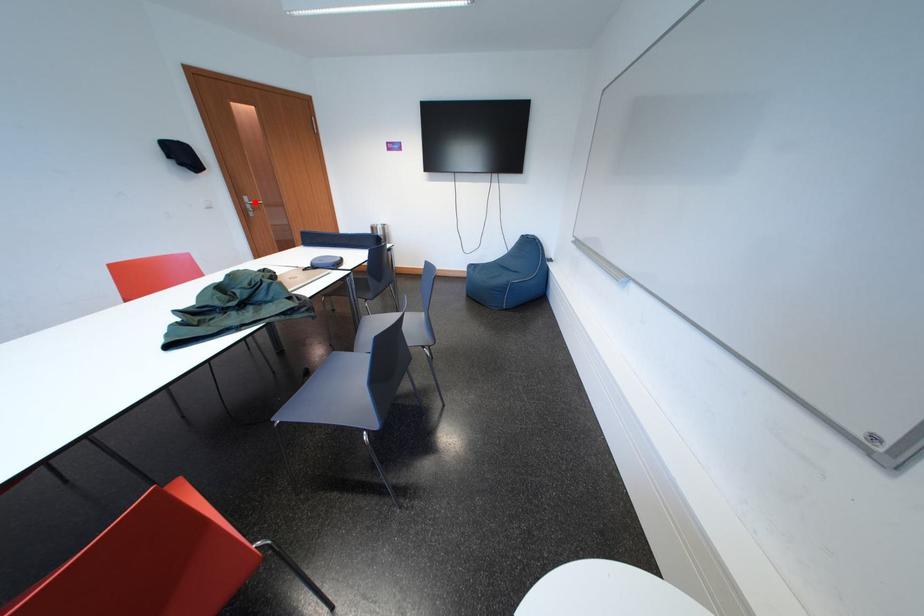
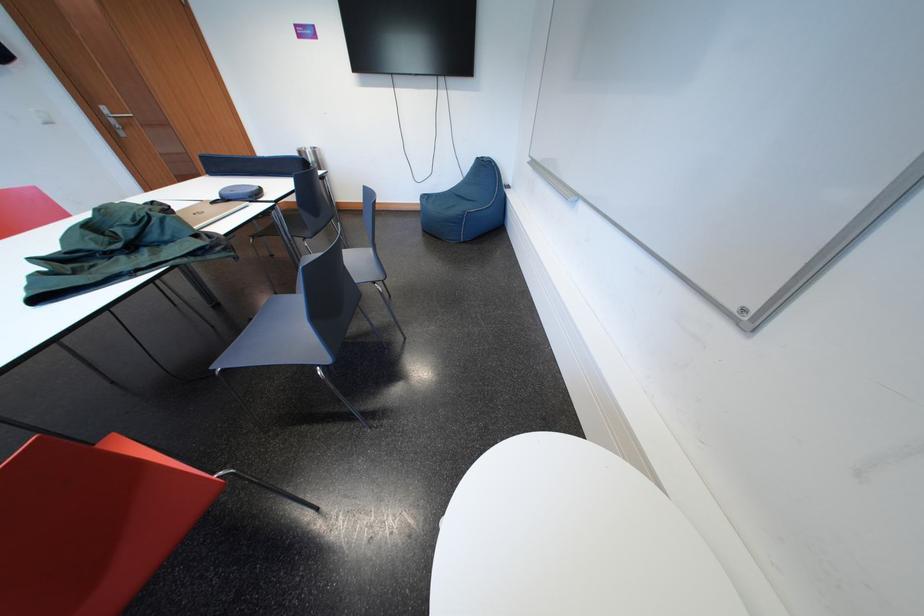
In the second image, find the point that corresponds to the highlighted location in the first image.

(113, 113)